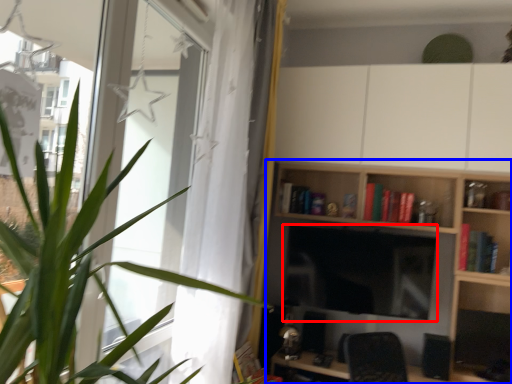
Question: Which of the following is the closest to the observer, computer monitor (highlighted by a red box) or shelf (highlighted by a blue box)?

Choices:
 (A) computer monitor
 (B) shelf

Answer: (B)